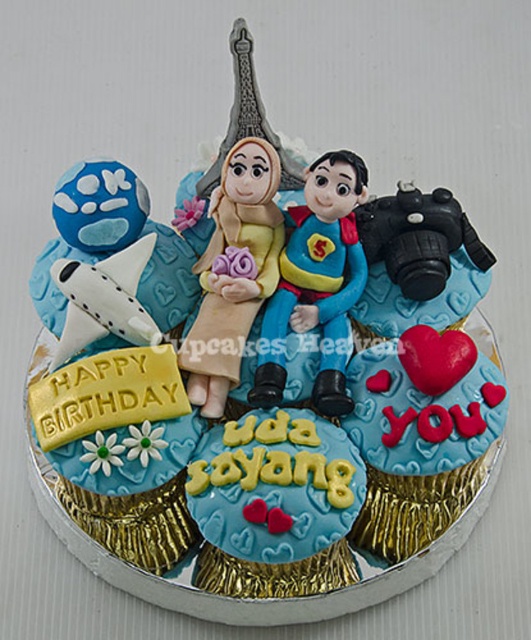
Looking at this image, which is below, matte plastic couple at center or matte yellow fabric doll at center?

matte plastic couple at center is lower down.

Is matte plastic couple at center positioned at the back of matte yellow fabric doll at center?

No, it is not.

You are a GUI agent. You are given a task and a screenshot of the screen. Output one action in this format:
    pyautogui.click(x=<x>, y=<y>)
    Task: Click on the matte plastic couple at center
    This screenshot has width=531, height=640.
    Given the screenshot: What is the action you would take?
    pyautogui.click(x=316, y=284)

The height and width of the screenshot is (640, 531). I want to click on matte plastic couple at center, so click(316, 284).

How much distance is there between matte plastic couple at center and matte blue airplane at left?

matte plastic couple at center and matte blue airplane at left are 6.07 inches apart.

The image size is (531, 640). Describe the element at coordinates (316, 284) in the screenshot. I see `matte plastic couple at center` at that location.

What do you see at coordinates (316, 284) in the screenshot? The width and height of the screenshot is (531, 640). I see `matte plastic couple at center` at bounding box center [316, 284].

Locate an element on the screen. This screenshot has width=531, height=640. matte plastic couple at center is located at coordinates (316, 284).

Which of these two, matte yellow fabric doll at center or matte blue airplane at left, stands shorter?

matte blue airplane at left

Is matte yellow fabric doll at center smaller than matte blue airplane at left?

Yes, matte yellow fabric doll at center is smaller than matte blue airplane at left.

Who is more distant from viewer, (250, 189) or (29, 285)?

The point (29, 285) is behind.

Image resolution: width=531 pixels, height=640 pixels. Find the location of `matte yellow fabric doll at center`. matte yellow fabric doll at center is located at coordinates (232, 276).